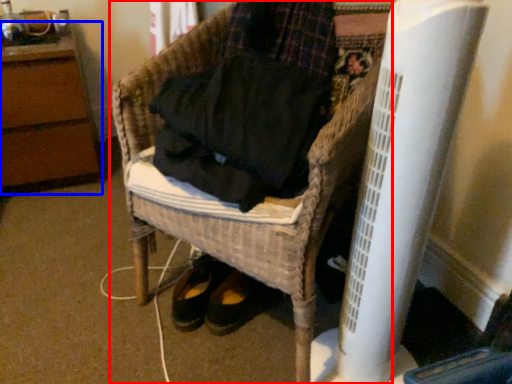
Question: Which of the following is the closest to the observer, furniture (highlighted by a red box) or furniture (highlighted by a blue box)?

Choices:
 (A) furniture
 (B) furniture

Answer: (A)